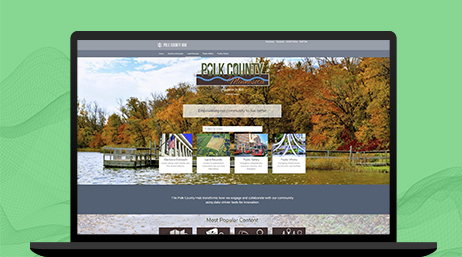
The height and width of the screenshot is (257, 462). Identify the location of shelf. (356, 248).